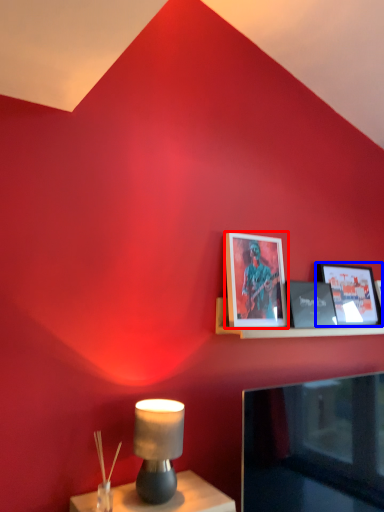
Question: Which of the following is the closest to the observer, picture frame (highlighted by a red box) or picture frame (highlighted by a blue box)?

Choices:
 (A) picture frame
 (B) picture frame

Answer: (A)